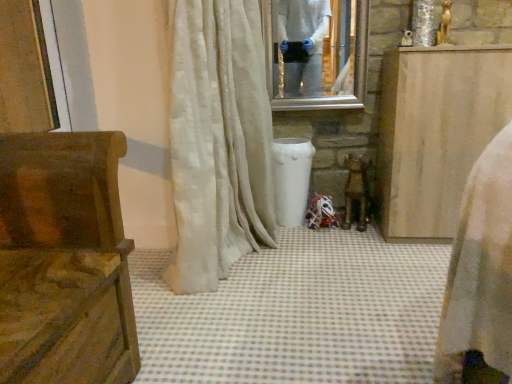
Question: Can you confirm if white silky curtain at center is wider than light brown wood cabinet at right, the first furniture viewed from the back?

Choices:
 (A) no
 (B) yes

Answer: (B)

Question: Would you say light brown wood cabinet at right, which appears as the second furniture when viewed from the left, is part of white silky curtain at center's contents?

Choices:
 (A) no
 (B) yes

Answer: (A)

Question: Does white silky curtain at center lie in front of light brown wood cabinet at right, which appears as the second furniture when viewed from the left?

Choices:
 (A) yes
 (B) no

Answer: (A)

Question: From the image's perspective, is white silky curtain at center on top of light brown wood cabinet at right, arranged as the first furniture when viewed from the right?

Choices:
 (A) no
 (B) yes

Answer: (B)

Question: Is white silky curtain at center smaller than light brown wood cabinet at right, which is counted as the second furniture, starting from the front?

Choices:
 (A) no
 (B) yes

Answer: (A)

Question: Is white silky curtain at center positioned with its back to light brown wood cabinet at right, the first furniture viewed from the back?

Choices:
 (A) yes
 (B) no

Answer: (B)

Question: Is the position of light brown wood cabinet at right, which is counted as the second furniture, starting from the front, more distant than that of white silky curtain at center?

Choices:
 (A) yes
 (B) no

Answer: (A)

Question: Is light brown wood cabinet at right, the first furniture viewed from the back, facing towards white silky curtain at center?

Choices:
 (A) yes
 (B) no

Answer: (B)

Question: Does light brown wood cabinet at right, arranged as the first furniture when viewed from the right, have a greater width compared to white silky curtain at center?

Choices:
 (A) no
 (B) yes

Answer: (A)

Question: Is light brown wood cabinet at right, which is counted as the second furniture, starting from the front, taller than white silky curtain at center?

Choices:
 (A) yes
 (B) no

Answer: (B)

Question: From the image's perspective, is light brown wood cabinet at right, which is counted as the second furniture, starting from the front, under white silky curtain at center?

Choices:
 (A) no
 (B) yes

Answer: (B)

Question: From the image's perspective, would you say light brown wood cabinet at right, which is counted as the second furniture, starting from the front, is positioned over white silky curtain at center?

Choices:
 (A) yes
 (B) no

Answer: (B)

Question: Considering the relative sizes of white silky curtain at center and clear glass mirror at upper center in the image provided, is white silky curtain at center smaller than clear glass mirror at upper center?

Choices:
 (A) yes
 (B) no

Answer: (B)